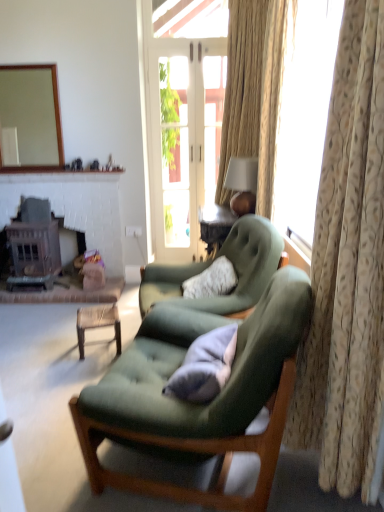
At what (x,y) coordinates should I click in order to perform the action: click on velvet green chair at center, the second chair when ordered from back to front. Please return your answer as a coordinate pair (x, y). Looking at the image, I should click on (201, 405).

In order to click on velvet green armchair at center, marked as the first chair in a back-to-front arrangement in this screenshot , I will do `click(211, 263)`.

The image size is (384, 512). Describe the element at coordinates (242, 184) in the screenshot. I see `matte brown lampshade at upper right` at that location.

Locate an element on the screen. The height and width of the screenshot is (512, 384). dark brown wood fireplace at lower left, the 2th fireplace positioned from the right is located at coordinates (34, 245).

Considering their positions, is dark brown wood fireplace at lower left, acting as the 1th fireplace starting from the left, located in front of or behind beige floral fabric curtain at right, positioned as the 1th curtain in front-to-back order?

dark brown wood fireplace at lower left, acting as the 1th fireplace starting from the left, is positioned farther from the viewer than beige floral fabric curtain at right, positioned as the 1th curtain in front-to-back order.

From the image's perspective, between dark brown wood fireplace at lower left, acting as the 1th fireplace starting from the left, and beige floral fabric curtain at right, positioned as the 1th curtain in front-to-back order, who is located below?

From the image's view, beige floral fabric curtain at right, positioned as the 1th curtain in front-to-back order, is below.

In the scene shown: Are dark brown wood fireplace at lower left, the 2th fireplace positioned from the right, and beige floral fabric curtain at right, which is counted as the second curtain, starting from the back, beside each other?

No, dark brown wood fireplace at lower left, the 2th fireplace positioned from the right, is not with beige floral fabric curtain at right, which is counted as the second curtain, starting from the back.

Between point (14, 284) and point (28, 177), which one is positioned behind?

The point (28, 177) is farther.

Considering the sizes of dark brown wood fireplace at lower left, the 2th fireplace positioned from the right, and rustic wood fireplace at left, which is counted as the 2th fireplace, starting from the left, in the image, is dark brown wood fireplace at lower left, the 2th fireplace positioned from the right, taller or shorter than rustic wood fireplace at left, which is counted as the 2th fireplace, starting from the left,?

Clearly, dark brown wood fireplace at lower left, the 2th fireplace positioned from the right, is shorter compared to rustic wood fireplace at left, which is counted as the 2th fireplace, starting from the left.

Who is bigger, dark brown wood fireplace at lower left, the 2th fireplace positioned from the right, or rustic wood fireplace at left, arranged as the 1th fireplace when viewed from the right?

With larger size is dark brown wood fireplace at lower left, the 2th fireplace positioned from the right.

Considering the relative sizes of dark brown wood fireplace at lower left, acting as the 1th fireplace starting from the left, and rustic wood fireplace at left, which is counted as the 2th fireplace, starting from the left, in the image provided, is dark brown wood fireplace at lower left, acting as the 1th fireplace starting from the left, wider than rustic wood fireplace at left, which is counted as the 2th fireplace, starting from the left,?

Yes, dark brown wood fireplace at lower left, acting as the 1th fireplace starting from the left, is wider than rustic wood fireplace at left, which is counted as the 2th fireplace, starting from the left.

Where is `curtain in front of the velvet green armchair at center, arranged as the 2th chair when viewed from the front`? The image size is (384, 512). curtain in front of the velvet green armchair at center, arranged as the 2th chair when viewed from the front is located at coordinates (347, 269).

How far apart are beige floral fabric curtain at right, positioned as the 1th curtain in front-to-back order, and velvet green armchair at center, arranged as the 2th chair when viewed from the front?

The distance of beige floral fabric curtain at right, positioned as the 1th curtain in front-to-back order, from velvet green armchair at center, arranged as the 2th chair when viewed from the front, is 3.35 feet.

From the image's perspective, is beige floral fabric curtain at right, positioned as the 1th curtain in front-to-back order, on velvet green armchair at center, marked as the first chair in a back-to-front arrangement?

Indeed, from the image's perspective, beige floral fabric curtain at right, positioned as the 1th curtain in front-to-back order, is shown above velvet green armchair at center, marked as the first chair in a back-to-front arrangement.

Would you say beige floral fabric curtain at right, positioned as the 1th curtain in front-to-back order, is outside velvet green armchair at center, marked as the first chair in a back-to-front arrangement?

Yes, beige floral fabric curtain at right, positioned as the 1th curtain in front-to-back order, is outside of velvet green armchair at center, marked as the first chair in a back-to-front arrangement.

From the image's perspective, is velvet green armchair at center, arranged as the 2th chair when viewed from the front, above or below white plastic power outlet at center?

velvet green armchair at center, arranged as the 2th chair when viewed from the front, is below white plastic power outlet at center.

Which is behind, velvet green armchair at center, arranged as the 2th chair when viewed from the front, or white plastic power outlet at center?

white plastic power outlet at center is further from the camera.

Identify the location of power outlet that appears on the left of velvet green armchair at center, marked as the first chair in a back-to-front arrangement. (133, 231).

Is velvet green armchair at center, arranged as the 2th chair when viewed from the front, turned away from white plastic power outlet at center?

No.

Does point (187, 143) appear closer or farther from the camera than point (126, 233)?

Point (187, 143) is positioned farther from the camera compared to point (126, 233).

From the image's perspective, relative to white plastic power outlet at center, is clear glass door at center above or below?

From the image's perspective, clear glass door at center appears above white plastic power outlet at center.

In the scene shown: Is clear glass door at center placed right next to white plastic power outlet at center?

No, clear glass door at center is not next to white plastic power outlet at center.

From a real-world perspective, is clear glass door at center located beneath white plastic power outlet at center?

No.

Locate an element on the screen. the 1st fireplace to the left of the matte brown lampshade at upper right, starting your count from the anchor is located at coordinates (74, 206).

Does rustic wood fireplace at left, arranged as the 1th fireplace when viewed from the right, lie in front of matte brown lampshade at upper right?

No, the depth of rustic wood fireplace at left, arranged as the 1th fireplace when viewed from the right, is greater than that of matte brown lampshade at upper right.

Is rustic wood fireplace at left, arranged as the 1th fireplace when viewed from the right, taller than matte brown lampshade at upper right?

Indeed, rustic wood fireplace at left, arranged as the 1th fireplace when viewed from the right, has a greater height compared to matte brown lampshade at upper right.

From a real-world perspective, is rustic wood fireplace at left, which is counted as the 2th fireplace, starting from the left, physically located above or below matte brown lampshade at upper right?

From a real-world perspective, rustic wood fireplace at left, which is counted as the 2th fireplace, starting from the left, is physically below matte brown lampshade at upper right.

Where is `curtain that is the 2nd object above the soft gray cushion at center (from a real-world perspective)`? The image size is (384, 512). curtain that is the 2nd object above the soft gray cushion at center (from a real-world perspective) is located at coordinates (253, 92).

Can you confirm if light beige textured curtain at right, marked as the second curtain in a front-to-back arrangement, is taller than soft gray cushion at center?

Yes, light beige textured curtain at right, marked as the second curtain in a front-to-back arrangement, is taller than soft gray cushion at center.

Considering the relative positions of light beige textured curtain at right, marked as the second curtain in a front-to-back arrangement, and soft gray cushion at center in the image provided, is light beige textured curtain at right, marked as the second curtain in a front-to-back arrangement, in front of soft gray cushion at center?

No, light beige textured curtain at right, marked as the second curtain in a front-to-back arrangement, is further to the viewer.

From the image's perspective, is light beige textured curtain at right, marked as the second curtain in a front-to-back arrangement, located above or below soft gray cushion at center?

From the image's perspective, light beige textured curtain at right, marked as the second curtain in a front-to-back arrangement, appears above soft gray cushion at center.

The width and height of the screenshot is (384, 512). What are the coordinates of `curtain that is the 2nd one when counting forward from the dark brown wood fireplace at lower left, acting as the 1th fireplace starting from the left` in the screenshot? It's located at (347, 269).

Locate an element on the screen. This screenshot has height=512, width=384. fireplace below the rustic wood fireplace at left, which is counted as the 2th fireplace, starting from the left (from a real-world perspective) is located at coordinates (34, 245).

Estimate the real-world distances between objects in this image. Which object is further from light beige textured curtain at right, which is counted as the first curtain, starting from the back, dark brown wood fireplace at lower left, acting as the 1th fireplace starting from the left, or wooden table at center?

dark brown wood fireplace at lower left, acting as the 1th fireplace starting from the left.

Based on their spatial positions, is velvet green chair at center, placed as the first chair when sorted from front to back, or matte brown lampshade at upper right further from dark brown wood fireplace at lower left, acting as the 1th fireplace starting from the left?

velvet green chair at center, placed as the first chair when sorted from front to back, lies further to dark brown wood fireplace at lower left, acting as the 1th fireplace starting from the left, than the other object.

From the image, which object appears to be nearer to beige floral fabric curtain at right, positioned as the 1th curtain in front-to-back order, clear glass door at center or velvet green armchair at center, arranged as the 2th chair when viewed from the front?

velvet green armchair at center, arranged as the 2th chair when viewed from the front, is positioned closer to the anchor beige floral fabric curtain at right, positioned as the 1th curtain in front-to-back order.

Considering their positions, is soft gray cushion at center positioned closer to velvet green chair at center, the second chair when ordered from back to front, than light beige textured curtain at right, which is counted as the first curtain, starting from the back?

soft gray cushion at center is positioned closer to the anchor velvet green chair at center, the second chair when ordered from back to front.

From the image, which object appears to be farther from beige floral fabric curtain at right, which is counted as the second curtain, starting from the back, soft gray cushion at center or wooden table at center?

wooden table at center.

When comparing their distances from rustic wood fireplace at left, which is counted as the 2th fireplace, starting from the left, does velvet green chair at center, the second chair when ordered from back to front, or matte brown lampshade at upper right seem further?

velvet green chair at center, the second chair when ordered from back to front, lies further to rustic wood fireplace at left, which is counted as the 2th fireplace, starting from the left, than the other object.

Looking at this image, estimate the real-world distances between objects in this image. Which object is closer to rustic wood fireplace at left, arranged as the 1th fireplace when viewed from the right, dark brown wood fireplace at lower left, acting as the 1th fireplace starting from the left, or velvet green chair at center, placed as the first chair when sorted from front to back?

Answer: dark brown wood fireplace at lower left, acting as the 1th fireplace starting from the left, lies closer to rustic wood fireplace at left, arranged as the 1th fireplace when viewed from the right, than the other object.

Looking at the image, which one is located further to velvet green chair at center, placed as the first chair when sorted from front to back, rustic wood fireplace at left, which is counted as the 2th fireplace, starting from the left, or clear glass door at center?

Among the two, clear glass door at center is located further to velvet green chair at center, placed as the first chair when sorted from front to back.

Where is `curtain between white plastic power outlet at center and matte brown lampshade at upper right in the horizontal direction`? Image resolution: width=384 pixels, height=512 pixels. curtain between white plastic power outlet at center and matte brown lampshade at upper right in the horizontal direction is located at coordinates (253, 92).

Find the location of a particular element. This screenshot has height=512, width=384. power outlet between rustic wood fireplace at left, arranged as the 1th fireplace when viewed from the right, and clear glass door at center, in the horizontal direction is located at coordinates (133, 231).

Where is `lamp between soft gray cushion at center and clear glass door at center along the z-axis`? lamp between soft gray cushion at center and clear glass door at center along the z-axis is located at coordinates (242, 184).

What are the coordinates of `table between beige floral fabric curtain at right, positioned as the 1th curtain in front-to-back order, and dark brown wood fireplace at lower left, acting as the 1th fireplace starting from the left, in the front-back direction` in the screenshot? It's located at (97, 323).